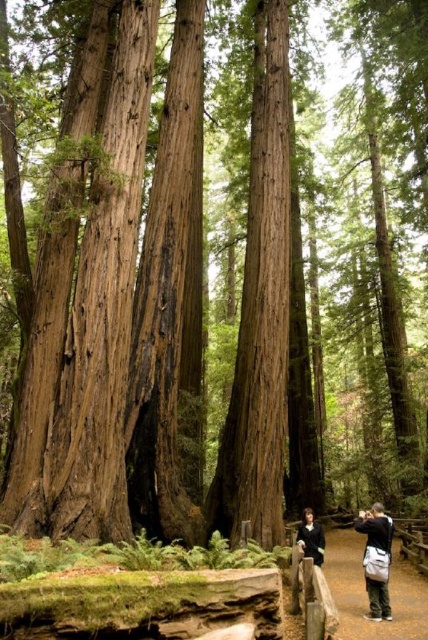
Is brown dirt path at center to the left of dark gray fabric camera bag at lower right from the viewer's perspective?

Incorrect, brown dirt path at center is not on the left side of dark gray fabric camera bag at lower right.

Who is more forward, (347, 604) or (368, 586)?

Point (368, 586) is in front.

Does point (392, 580) lie in front of point (380, 512)?

No.

The height and width of the screenshot is (640, 428). I want to click on brown dirt path at center, so click(365, 593).